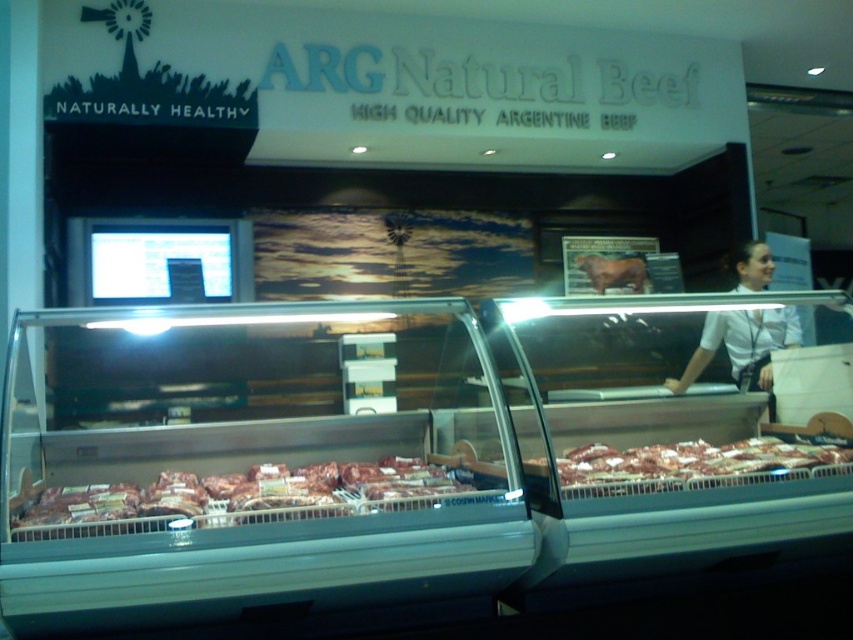
You are a customer at the retail display for ARG Natural Beef. You want to pick up the raw red meat at center. Based on the coordinates provided in the Objects Description, can you determine its exact position within the display case?

The raw red meat at center is located at point coordinates of (694, 464), which would be its exact position within the display case.

You are a customer looking at the refrigerated display case for ARG Natural Beef. You see the raw red meat at center and the white shirt at upper right. Which object is closer to the left side of the display case?

The raw red meat at center is closer to the left side of the display case because it is positioned to the left of the white shirt at upper right.